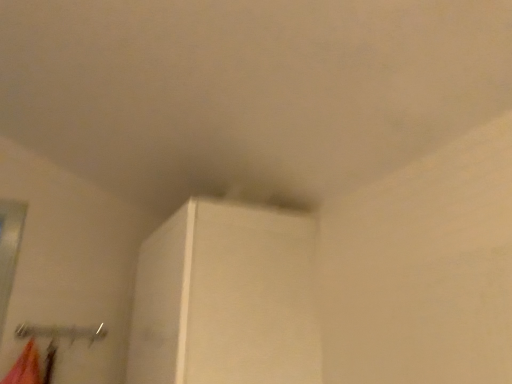
This screenshot has height=384, width=512. What do you see at coordinates (226, 299) in the screenshot?
I see `white matte cabinet at center` at bounding box center [226, 299].

Locate an element on the screen. The width and height of the screenshot is (512, 384). white matte cabinet at center is located at coordinates (226, 299).

This screenshot has width=512, height=384. Identify the location of white matte cabinet at center. (226, 299).